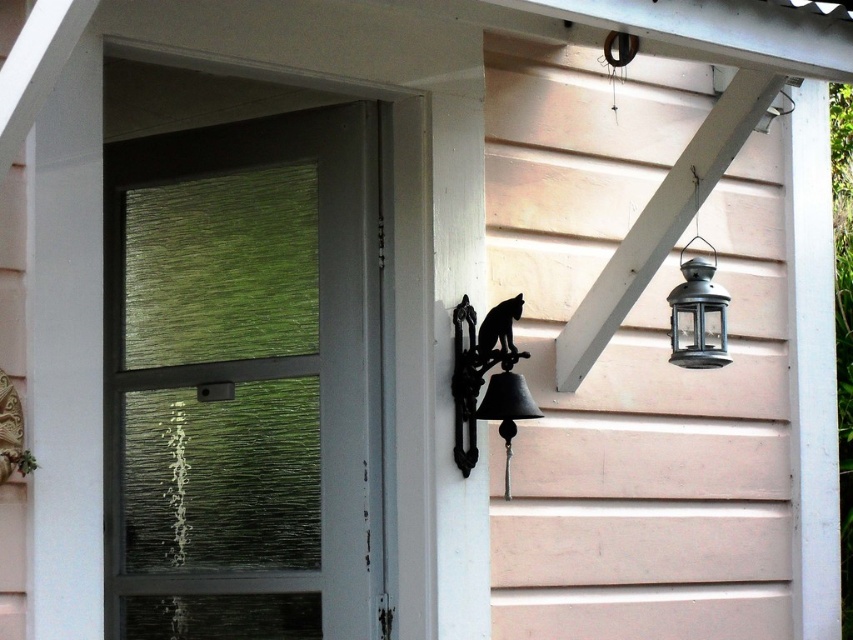
Is point (491, 392) less distant than point (683, 305)?

Yes, it is in front of point (683, 305).

Locate an element on the screen. Image resolution: width=853 pixels, height=640 pixels. black wrought iron bell at center is located at coordinates (489, 380).

Which is behind, point (212, 280) or point (712, 298)?

Point (212, 280)

Locate an element on the screen. The image size is (853, 640). green frosted glass window at left is located at coordinates tap(242, 378).

You are a GUI agent. You are given a task and a screenshot of the screen. Output one action in this format:
    pyautogui.click(x=<x>, y=<y>)
    Task: Click on the green frosted glass window at left
    Image resolution: width=853 pixels, height=640 pixels.
    Given the screenshot: What is the action you would take?
    pyautogui.click(x=242, y=378)

Where is `green frosted glass window at left`? green frosted glass window at left is located at coordinates (242, 378).

Does black wrought iron bell at center come behind black metal bell at center?

Answer: Yes.

Does point (469, 416) come closer to viewer compared to point (509, 445)?

No, it is not.

Is point (456, 403) more distant than point (509, 394)?

Yes, it is behind point (509, 394).

The width and height of the screenshot is (853, 640). Find the location of `black wrought iron bell at center`. black wrought iron bell at center is located at coordinates (489, 380).